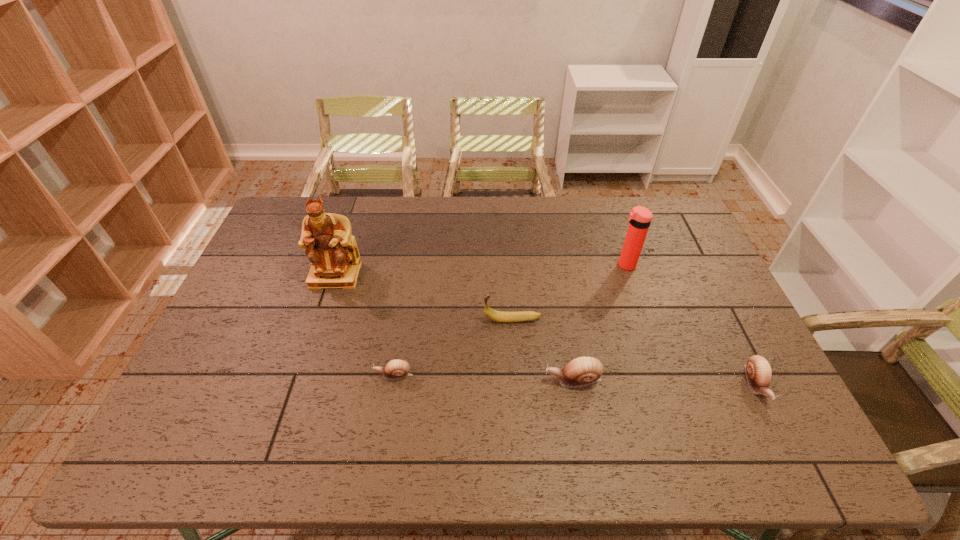
Where is `free space located on the left of the second object from right to left`? free space located on the left of the second object from right to left is located at coordinates (591, 265).

You are a GUI agent. You are given a task and a screenshot of the screen. Output one action in this format:
    pyautogui.click(x=<x>, y=<y>)
    Task: Click on the vacant space located 0.110m on the front-facing side of the leftmost object
    The image size is (960, 540).
    Given the screenshot: What is the action you would take?
    pyautogui.click(x=322, y=316)

The image size is (960, 540). I want to click on object that is at the right edge, so click(758, 371).

Where is `object situated at the near right corner`? object situated at the near right corner is located at coordinates (758, 371).

Find the location of a particular element. free region at the far edge of the desktop is located at coordinates (343, 212).

You are a GUI agent. You are given a task and a screenshot of the screen. Output one action in this format:
    pyautogui.click(x=<x>, y=<y>)
    Task: Click on the vacant space at the near edge
    
    Given the screenshot: What is the action you would take?
    pyautogui.click(x=656, y=412)

Identify the location of vacant space at the right edge of the desktop. Image resolution: width=960 pixels, height=540 pixels. (717, 340).

At what (x,y) coordinates should I click in order to perform the action: click on free space between the second object from left to right and the leftmost object. Please return your answer as a coordinate pair (x, y). This screenshot has height=540, width=960. Looking at the image, I should click on (365, 325).

This screenshot has width=960, height=540. Find the location of `free space between the figurine and the banana`. free space between the figurine and the banana is located at coordinates (424, 298).

The image size is (960, 540). What are the coordinates of `free space between the second object from right to left and the tallest escargot` in the screenshot? It's located at (599, 322).